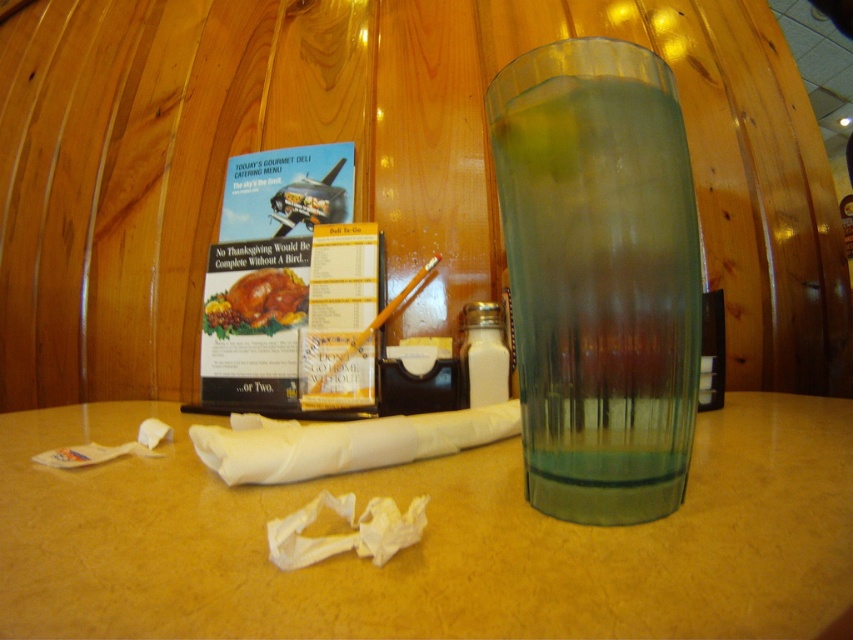
Question: Based on their relative distances, which object is farther from the clear glass at right?

Choices:
 (A) smooth beige table at center
 (B) golden roasted turkey at center

Answer: (B)

Question: Does smooth beige table at center appear under clear glass at right?

Choices:
 (A) no
 (B) yes

Answer: (B)

Question: Which of these objects is positioned farthest from the smooth beige table at center?

Choices:
 (A) clear glass at right
 (B) golden roasted turkey at center

Answer: (B)

Question: Can you confirm if smooth beige table at center is positioned above clear glass at right?

Choices:
 (A) yes
 (B) no

Answer: (B)

Question: Which point is closer to the camera?

Choices:
 (A) (548, 211)
 (B) (712, 490)

Answer: (A)

Question: Is smooth beige table at center to the left of golden roasted turkey at center from the viewer's perspective?

Choices:
 (A) yes
 (B) no

Answer: (B)